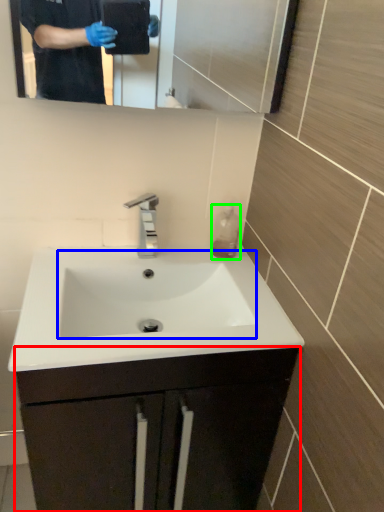
Question: Which is farther away from bathroom cabinet (highlighted by a red box)? sink (highlighted by a blue box) or liquid (highlighted by a green box)?

Choices:
 (A) sink
 (B) liquid

Answer: (B)